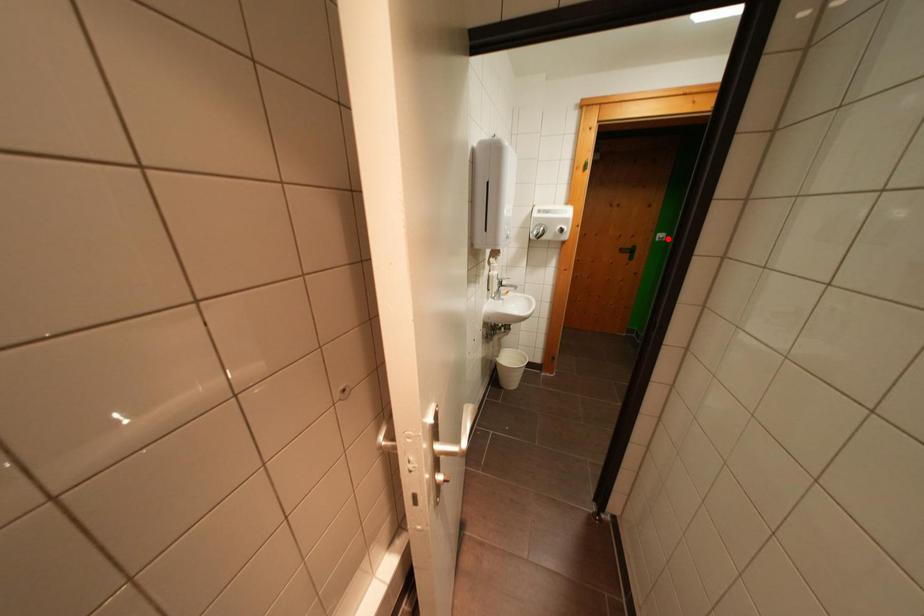
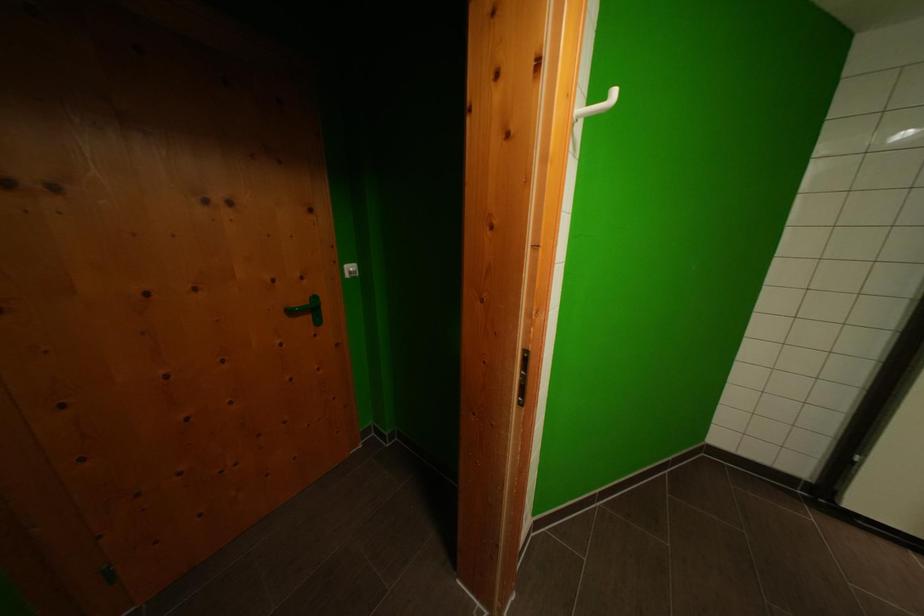
Find the pixel in the second image that matches the highlighted location in the first image.

(358, 272)